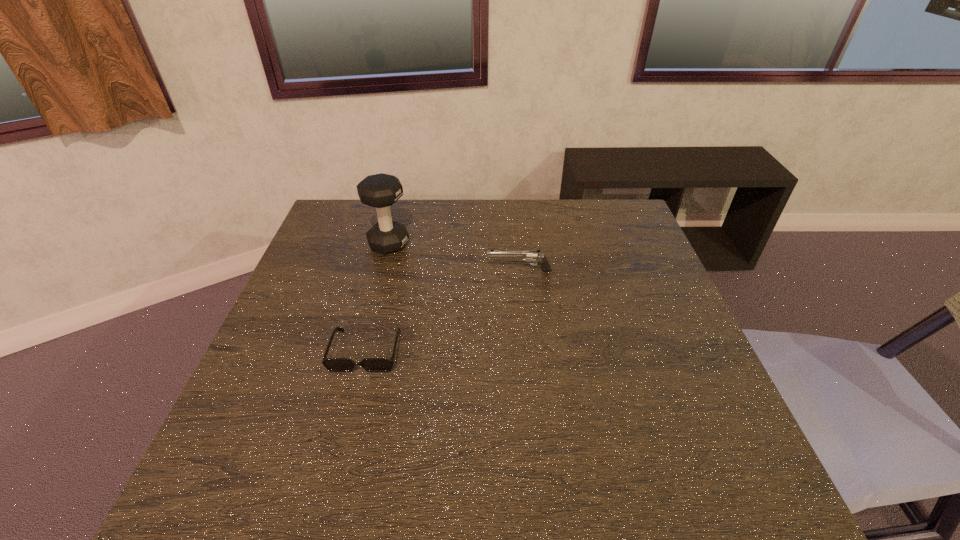
What are the coordinates of `vacant position located 0.280m on the front-facing side of the shortest object` in the screenshot? It's located at (326, 510).

In order to click on object that is at the far edge in this screenshot , I will do point(381,190).

At what (x,y) coordinates should I click in order to perform the action: click on object at the left edge. Please return your answer as a coordinate pair (x, y). Image resolution: width=960 pixels, height=540 pixels. Looking at the image, I should click on (331, 364).

You are a GUI agent. You are given a task and a screenshot of the screen. Output one action in this format:
    pyautogui.click(x=<x>, y=<y>)
    Task: Click on the vacant position at the far edge of the desktop
    Image resolution: width=960 pixels, height=540 pixels.
    Given the screenshot: What is the action you would take?
    pyautogui.click(x=578, y=222)

Identify the location of vacant space at the left edge of the desktop. (278, 371).

Identify the location of vacant point at the right edge. (613, 292).

Locate an element on the screen. This screenshot has height=540, width=960. free space at the far left corner is located at coordinates (354, 206).

Identify the location of vacant space at the far right corner. The image size is (960, 540). (636, 240).

Locate an element on the screen. This screenshot has width=960, height=540. vacant region at the near right corner is located at coordinates (667, 464).

This screenshot has height=540, width=960. In order to click on vacant area between the second shortest object and the dumbbell in this screenshot , I will do `click(454, 258)`.